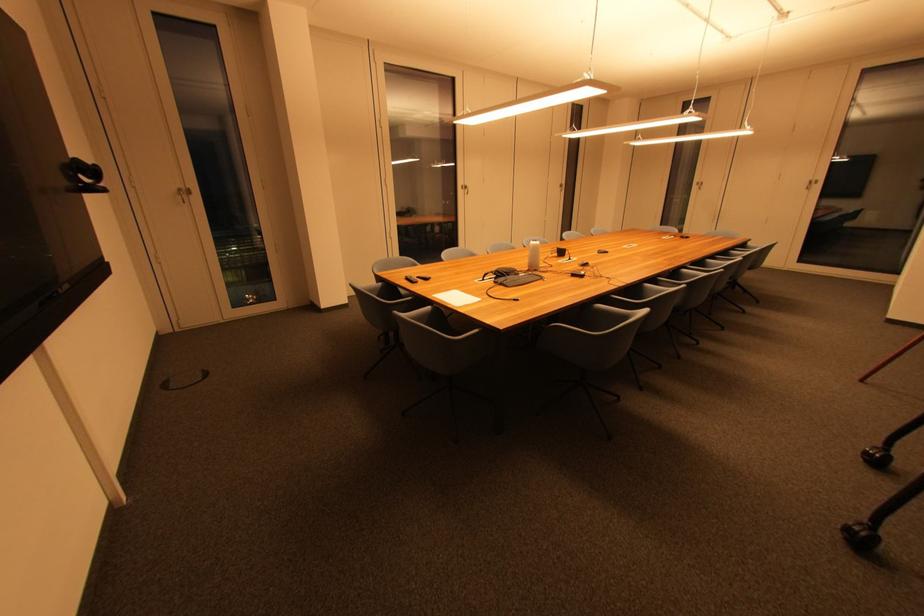
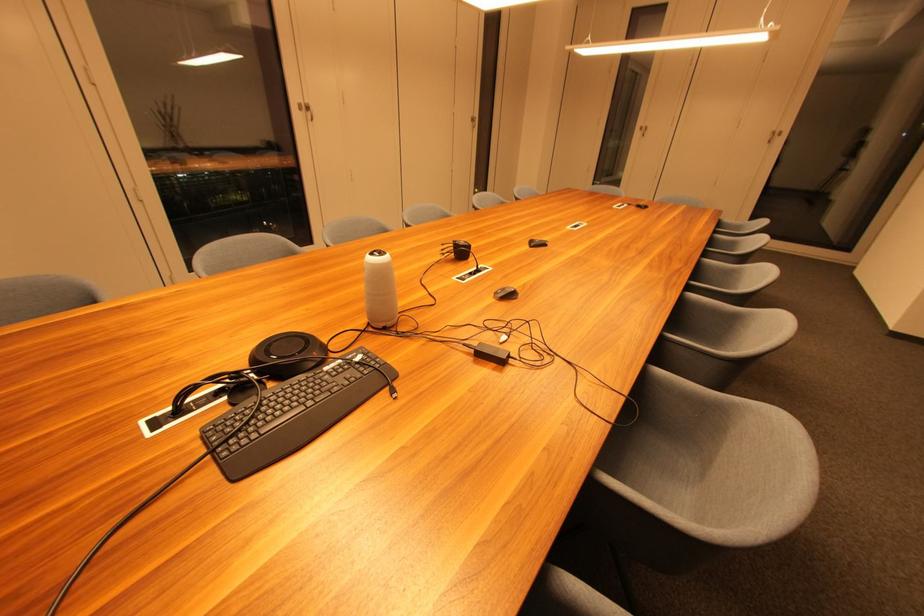
In a continuous first-person perspective shot, in which direction is the camera moving?

The cameraman moved toward right, forward.